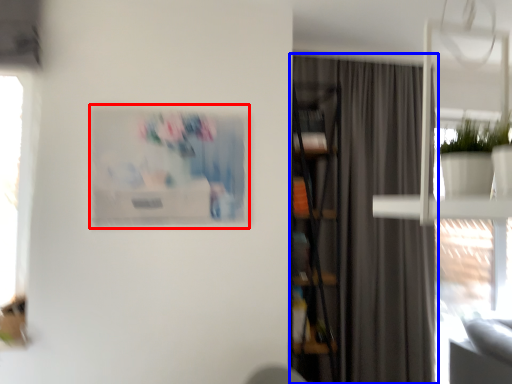
Question: Which object appears closest to the camera in this image, picture frame (highlighted by a red box) or curtain (highlighted by a blue box)?

Choices:
 (A) picture frame
 (B) curtain

Answer: (A)